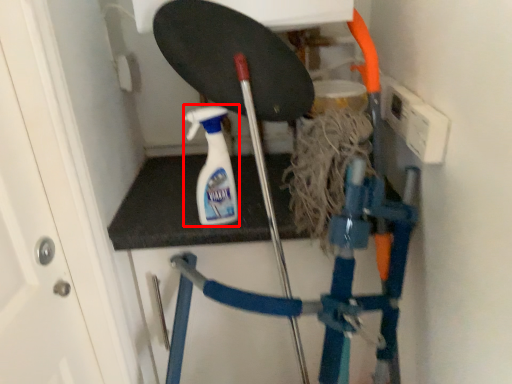
Question: From the image's perspective, what is the correct spatial positioning of cleaning product (annotated by the red box) in reference to ladder?

Choices:
 (A) above
 (B) below

Answer: (A)